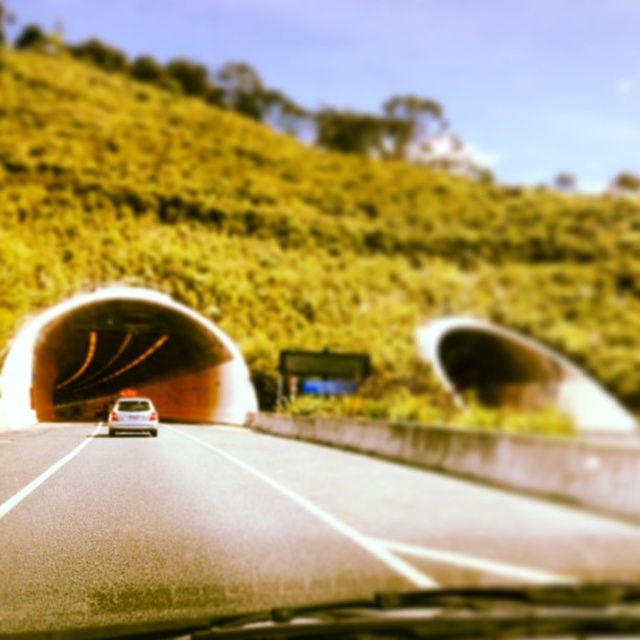
You are a driver navigating a car. You need to stay within the gray asphalt road at center. What coordinates should you aim for to stay centered on the road?

To stay centered on the gray asphalt road at center, aim for the coordinates at point (259, 528).

You are driving a car that is 15 feet long. You see the green grassy hillside at upper center ahead. Can your car safely stop before reaching it if you need to?

The green grassy hillside at upper center is 135.04 feet away from you. Since your car is 15 feet long, there is sufficient distance to safely stop before reaching it.

You are driving a car and want to ensure there is enough space to safely pass another vehicle ahead. Based on the scene, can you determine if the gray asphalt road at center is wide enough to accommodate both your car and the white matte car at center side by side?

The gray asphalt road at center might be wider than the white matte car at center, so there could be enough space to safely pass the white matte car at center. However, since the exact width difference isn not specified, proceed with caution and check road conditions.